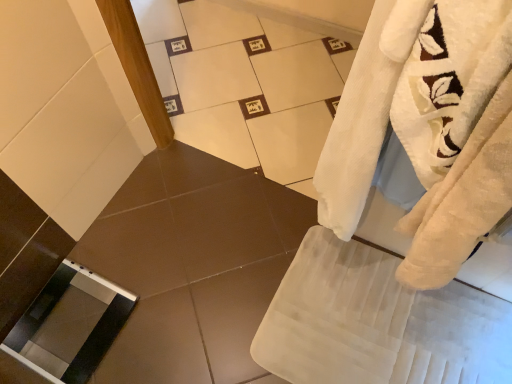
From the picture: Measure the distance between white soft bath towel at lower right and camera.

white soft bath towel at lower right and camera are 1.20 meters apart from each other.

Identify the location of white soft bath towel at lower right. The height and width of the screenshot is (384, 512). (377, 323).

What do you see at coordinates (377, 323) in the screenshot?
I see `white soft bath towel at lower right` at bounding box center [377, 323].

From the picture: Measure the distance between clear glass screen door at lower left and camera.

A distance of 4.06 feet exists between clear glass screen door at lower left and camera.

You are a GUI agent. You are given a task and a screenshot of the screen. Output one action in this format:
    pyautogui.click(x=<x>, y=<y>)
    Task: Click on the clear glass screen door at lower left
    
    Given the screenshot: What is the action you would take?
    pyautogui.click(x=70, y=325)

The width and height of the screenshot is (512, 384). What do you see at coordinates (70, 325) in the screenshot?
I see `clear glass screen door at lower left` at bounding box center [70, 325].

Locate an element on the screen. white soft bath towel at lower right is located at coordinates (377, 323).

Which object is positioned more to the right, white soft bath towel at lower right or clear glass screen door at lower left?

white soft bath towel at lower right.

In the image, is white soft bath towel at lower right positioned in front of or behind clear glass screen door at lower left?

white soft bath towel at lower right is positioned closer to the viewer than clear glass screen door at lower left.

Considering the points (279, 304) and (36, 303), which point is in front, point (279, 304) or point (36, 303)?

The point (279, 304) is in front.

From the image's perspective, is white soft bath towel at lower right beneath clear glass screen door at lower left?

Yes, from the image's perspective, white soft bath towel at lower right is beneath clear glass screen door at lower left.

Looking at this image, from a real-world perspective, between white soft bath towel at lower right and clear glass screen door at lower left, who is vertically higher?

white soft bath towel at lower right, from a real-world perspective.

Which of these two, white soft bath towel at lower right or clear glass screen door at lower left, is wider?

white soft bath towel at lower right.

Is white soft bath towel at lower right taller than clear glass screen door at lower left?

Indeed, white soft bath towel at lower right has a greater height compared to clear glass screen door at lower left.

Which of these two, white soft bath towel at lower right or clear glass screen door at lower left, is smaller?

clear glass screen door at lower left.

Would you say white soft bath towel at lower right contains clear glass screen door at lower left?

That's incorrect, clear glass screen door at lower left is not inside white soft bath towel at lower right.

Does white soft bath towel at lower right touch clear glass screen door at lower left?

white soft bath towel at lower right and clear glass screen door at lower left are clearly separated.

Is white soft bath towel at lower right oriented towards clear glass screen door at lower left?

Yes, white soft bath towel at lower right is turned towards clear glass screen door at lower left.

How many degrees apart are the facing directions of white soft bath towel at lower right and clear glass screen door at lower left?

The angular difference between white soft bath towel at lower right and clear glass screen door at lower left is 91.2 degrees.

How far apart are white soft bath towel at lower right and clear glass screen door at lower left?

They are 26.53 inches apart.

The image size is (512, 384). I want to click on bath towel to the right of clear glass screen door at lower left, so click(377, 323).

Considering the positions of objects clear glass screen door at lower left and white soft bath towel at lower right in the image provided, who is more to the right, clear glass screen door at lower left or white soft bath towel at lower right?

From the viewer's perspective, white soft bath towel at lower right appears more on the right side.

Which object is closer to the camera taking this photo, clear glass screen door at lower left or white soft bath towel at lower right?

white soft bath towel at lower right is closer to the camera.

Which is closer, [86,322] or [279,343]?

Point [86,322] is farther from the camera than point [279,343].

From the image's perspective, which is above, clear glass screen door at lower left or white soft bath towel at lower right?

clear glass screen door at lower left.

From a real-world perspective, who is located higher, clear glass screen door at lower left or white soft bath towel at lower right?

white soft bath towel at lower right.

Does clear glass screen door at lower left have a greater width compared to white soft bath towel at lower right?

No.

Which of these two, clear glass screen door at lower left or white soft bath towel at lower right, stands shorter?

With less height is clear glass screen door at lower left.

Who is bigger, clear glass screen door at lower left or white soft bath towel at lower right?

white soft bath towel at lower right.

Is clear glass screen door at lower left inside or outside of white soft bath towel at lower right?

clear glass screen door at lower left cannot be found inside white soft bath towel at lower right.

Are clear glass screen door at lower left and white soft bath towel at lower right far apart?

No, there isn't a large distance between clear glass screen door at lower left and white soft bath towel at lower right.

Is clear glass screen door at lower left oriented away from white soft bath towel at lower right?

clear glass screen door at lower left is not turned away from white soft bath towel at lower right.

Can you tell me how much clear glass screen door at lower left and white soft bath towel at lower right differ in facing direction?

The angular difference between clear glass screen door at lower left and white soft bath towel at lower right is 91.2 degrees.

Find the location of `bath towel below the clear glass screen door at lower left (from the image's perspective)`. bath towel below the clear glass screen door at lower left (from the image's perspective) is located at coordinates (377, 323).

Where is `screen door on the left of white soft bath towel at lower right`? screen door on the left of white soft bath towel at lower right is located at coordinates (70, 325).

Find the location of a particular element. bath towel that appears above the clear glass screen door at lower left (from a real-world perspective) is located at coordinates (377, 323).